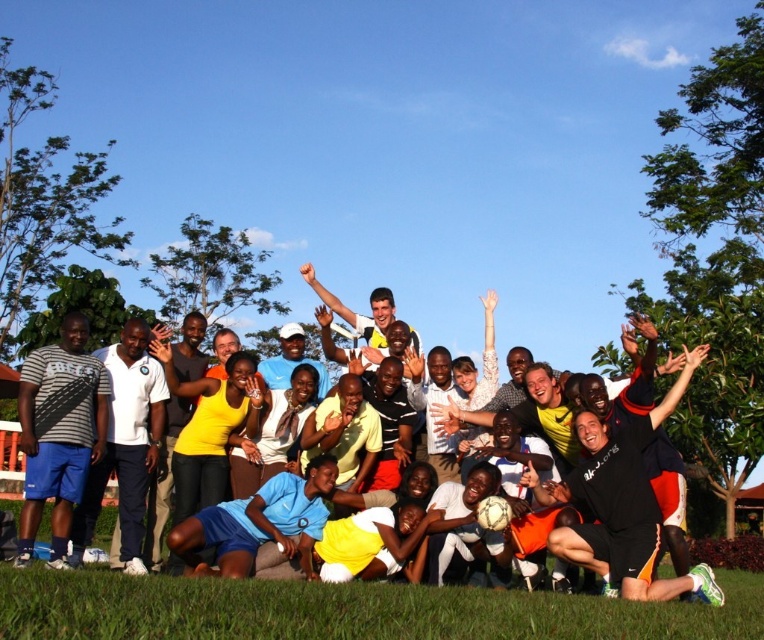
Can you confirm if green grass at lower center is positioned above yellow jersey at center?

Actually, green grass at lower center is below yellow jersey at center.

Does green grass at lower center have a lesser height compared to yellow jersey at center?

No.

Where is `green grass at lower center`? green grass at lower center is located at coordinates (348, 611).

Can you confirm if matte gray shorts at left is positioned to the right of yellow jersey at center?

In fact, matte gray shorts at left is to the left of yellow jersey at center.

Which is in front, point (157, 385) or point (290, 340)?

Positioned in front is point (157, 385).

Locate an element on the screen. The image size is (764, 640). matte gray shorts at left is located at coordinates (125, 445).

Can you confirm if matte black shirt at left is bigger than yellow jersey at center?

Indeed, matte black shirt at left has a larger size compared to yellow jersey at center.

Who is shorter, matte black shirt at left or yellow jersey at center?

Standing shorter between the two is yellow jersey at center.

I want to click on matte black shirt at left, so click(x=60, y=433).

Where is `matte black shirt at left`? The height and width of the screenshot is (640, 764). matte black shirt at left is located at coordinates (60, 433).